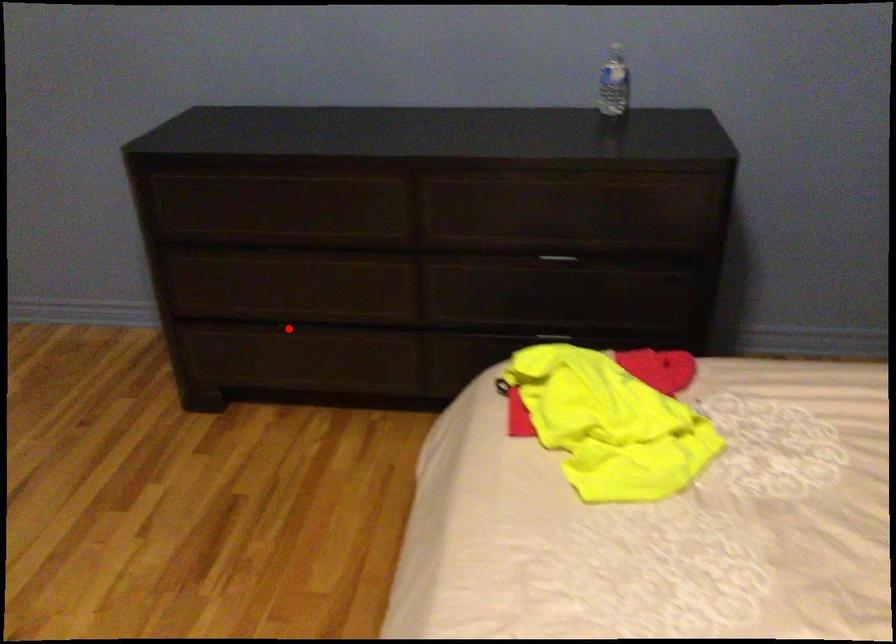
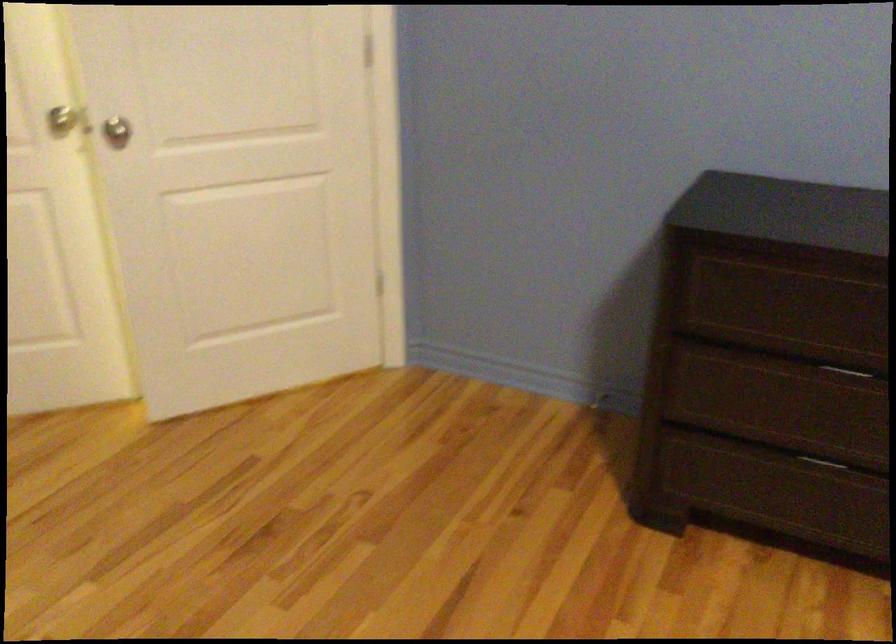
Question: I am providing you with two images of the same scene from different viewpoints. In image1, a red point is highlighted. Considering the same 3D point in image2, which of the following is correct?

Choices:
 (A) It is closer
 (B) It is farther

Answer: (A)